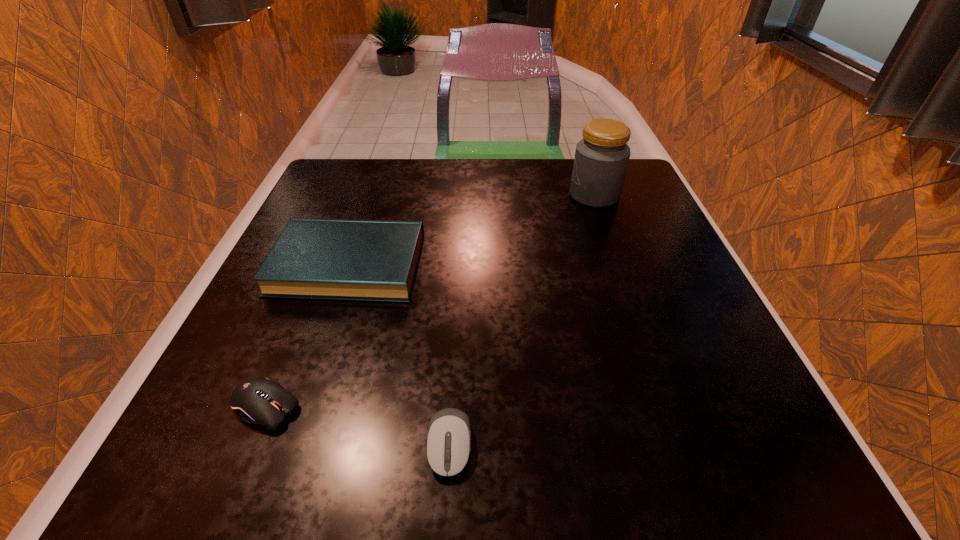
This screenshot has height=540, width=960. Find the location of `jar`. jar is located at coordinates (601, 159).

This screenshot has width=960, height=540. Identify the location of the tallest object. (601, 159).

Locate an element on the screen. Image resolution: width=960 pixels, height=540 pixels. book is located at coordinates (333, 259).

Find the location of a particular element. Image resolution: width=960 pixels, height=540 pixels. the left computer equipment is located at coordinates (258, 400).

Identify the location of the right computer equipment. (448, 445).

Identify the location of free region located 0.270m on the surface of the jar near the warning symbol. (455, 195).

The height and width of the screenshot is (540, 960). In order to click on free spot located 0.230m on the surface of the jar near the warning symbol in this screenshot , I will do `click(471, 195)`.

At what (x,y) coordinates should I click in order to perform the action: click on free space located 0.140m on the surface of the jar near the warning symbol. Please return your answer as a coordinate pair (x, y). The height and width of the screenshot is (540, 960). Looking at the image, I should click on (510, 195).

At what (x,y) coordinates should I click in order to perform the action: click on vacant area located on the front of the second farthest object. Please return your answer as a coordinate pair (x, y). Looking at the image, I should click on (277, 473).

At what (x,y) coordinates should I click in order to perform the action: click on blank area located on the right of the left computer equipment. Please return your answer as a coordinate pair (x, y). Looking at the image, I should click on (513, 407).